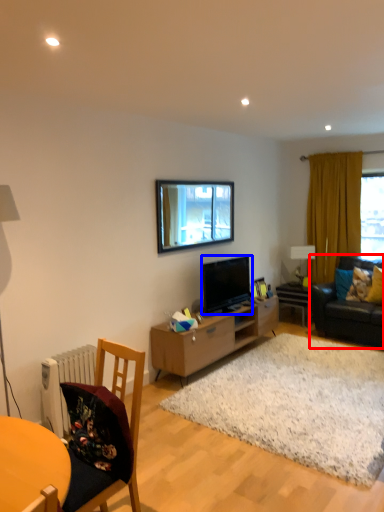
Question: Which point is closer to the camera, studio couch (highlighted by a red box) or television (highlighted by a blue box)?

Choices:
 (A) studio couch
 (B) television

Answer: (B)